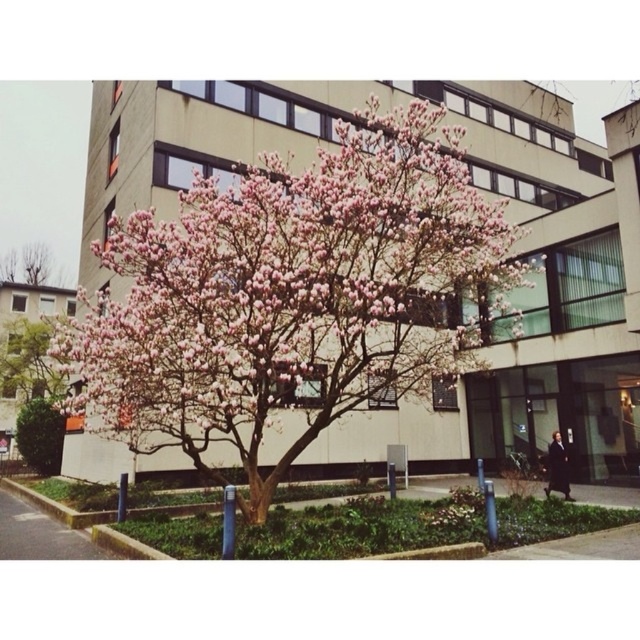
Which is more to the right, pink bloom tree at center or pink bloom tree at upper left?

pink bloom tree at center

The width and height of the screenshot is (640, 640). What do you see at coordinates (291, 296) in the screenshot?
I see `pink bloom tree at center` at bounding box center [291, 296].

Locate an element on the screen. pink bloom tree at center is located at coordinates (291, 296).

Is pink bloom tree at center smaller than pink bloom tree at left?

No.

Which is in front, point (250, 458) or point (13, 356)?

Point (250, 458) is more forward.

Is point (272, 243) positioned behind point (38, 337)?

No, it is in front of (38, 337).

Where is `pink bloom tree at center`? The image size is (640, 640). pink bloom tree at center is located at coordinates (291, 296).

Which is more to the right, pink bloom tree at left or pink bloom tree at upper left?

From the viewer's perspective, pink bloom tree at left appears more on the right side.

Is pink bloom tree at left below pink bloom tree at upper left?

Yes.

At what (x,y) coordinates should I click in order to perform the action: click on pink bloom tree at left. Please return your answer as a coordinate pair (x, y). Looking at the image, I should click on (29, 358).